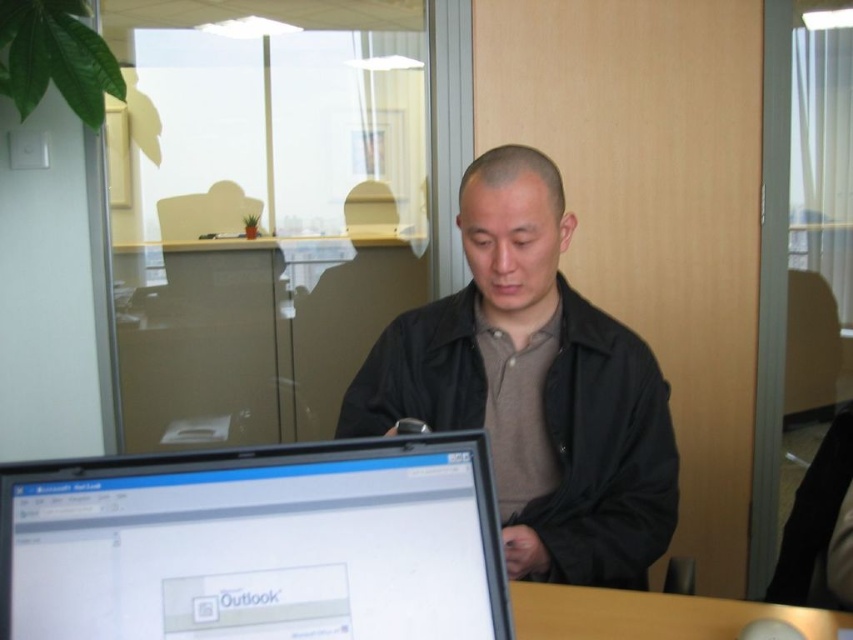
Is matte black laptop at lower left below black matte jacket at center?

Correct, matte black laptop at lower left is located below black matte jacket at center.

The height and width of the screenshot is (640, 853). What do you see at coordinates (256, 545) in the screenshot?
I see `matte black laptop at lower left` at bounding box center [256, 545].

Describe the element at coordinates (256, 545) in the screenshot. This screenshot has height=640, width=853. I see `matte black laptop at lower left` at that location.

Identify the location of matte black laptop at lower left. (256, 545).

In the scene shown: Does black matte jacket at center have a greater height compared to brown wooden table at lower center?

Yes.

Which is more to the right, black matte jacket at center or brown wooden table at lower center?

brown wooden table at lower center

This screenshot has height=640, width=853. What are the coordinates of `black matte jacket at center` in the screenshot? It's located at (534, 387).

Which is more to the left, matte black laptop at lower left or brown wooden table at lower center?

From the viewer's perspective, matte black laptop at lower left appears more on the left side.

Does matte black laptop at lower left appear under brown wooden table at lower center?

No.

Measure the distance between point [502,636] and camera.

A distance of 34.29 inches exists between point [502,636] and camera.

I want to click on matte black laptop at lower left, so click(x=256, y=545).